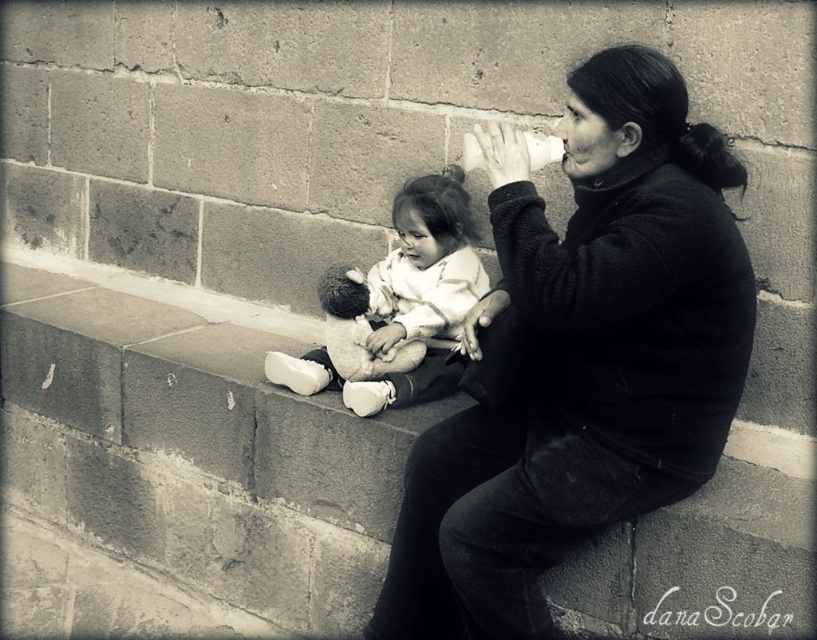
This screenshot has height=640, width=817. What do you see at coordinates (579, 358) in the screenshot?
I see `matte black jacket at center` at bounding box center [579, 358].

Is matte black jacket at center to the left of white plush doll at center from the viewer's perspective?

No, matte black jacket at center is not to the left of white plush doll at center.

Is point (480, 458) positioned after point (280, 353)?

That is False.

This screenshot has width=817, height=640. In order to click on matte black jacket at center in this screenshot , I will do `click(579, 358)`.